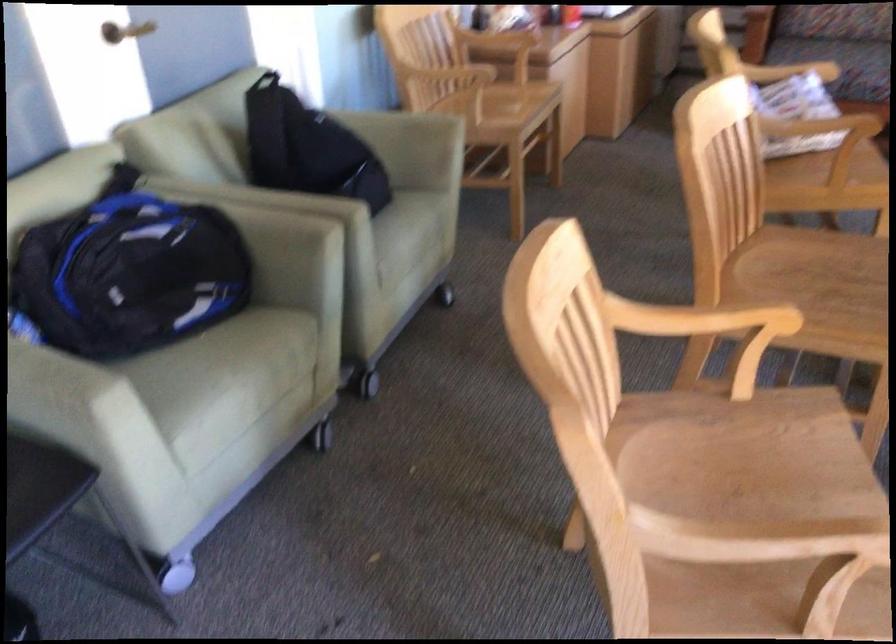
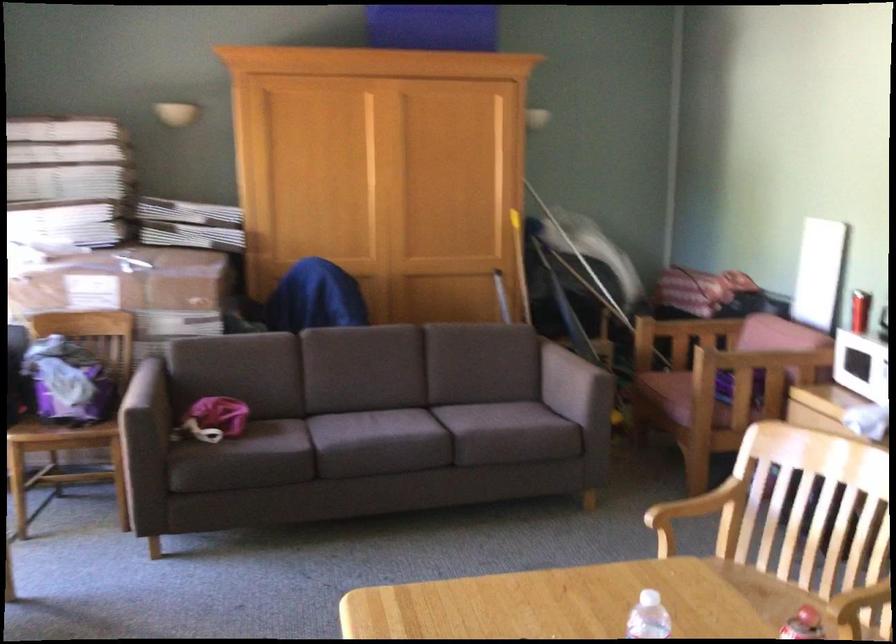
In the second image, find the point that corresponds to the point at 699,312 in the first image.

(860, 609)